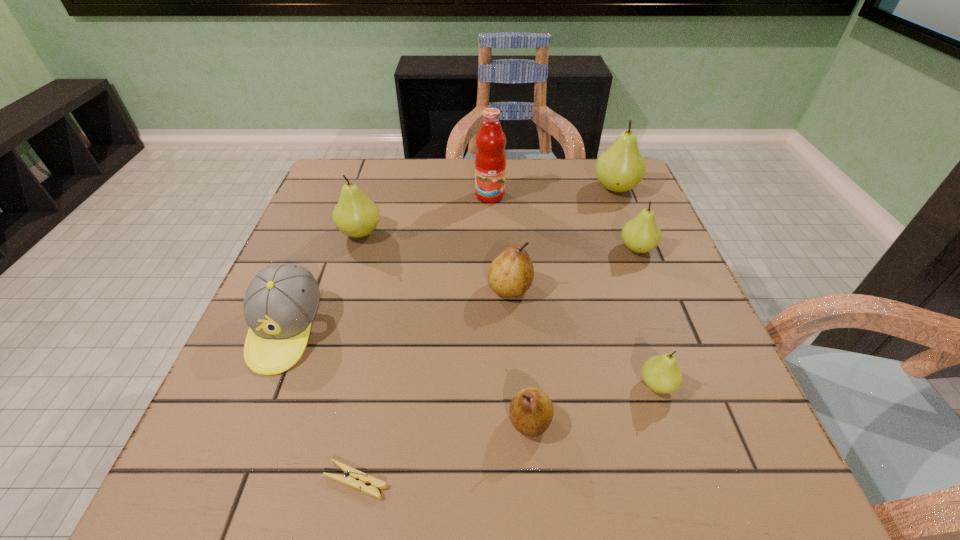
Where is `free space between the shortest object and the bigger brown pear`? The width and height of the screenshot is (960, 540). free space between the shortest object and the bigger brown pear is located at coordinates (433, 384).

Where is `free space between the third biggest green pear and the third nearest pear`? The height and width of the screenshot is (540, 960). free space between the third biggest green pear and the third nearest pear is located at coordinates (573, 268).

Identify the location of object that is the closest to the smaller brown pear. (661, 374).

This screenshot has width=960, height=540. I want to click on object that is the sixth closest to the smallest green pear, so click(x=490, y=159).

Identify which pear is located as the sixth nearest to the fruit juice. Please provide its 2D coordinates. Your answer should be formatted as a tuple, i.e. [(x, y)], where the tuple contains the x and y coordinates of a point satisfying the conditions above.

[(531, 411)]

Locate an element on the screen. the fourth closest pear to the biggest green pear is located at coordinates point(355,215).

Where is `green pear that stands as the fourth closest to the clothespin`? This screenshot has height=540, width=960. green pear that stands as the fourth closest to the clothespin is located at coordinates (620, 168).

You are a GUI agent. You are given a task and a screenshot of the screen. Output one action in this format:
    pyautogui.click(x=<x>, y=<y>)
    Task: Click on the second closest green pear to the fruit juice
    
    Given the screenshot: What is the action you would take?
    pyautogui.click(x=620, y=168)

You are a GUI agent. You are given a task and a screenshot of the screen. Output one action in this format:
    pyautogui.click(x=<x>, y=<y>)
    Task: Click on the free location that satisfies the following two spatial constraints: 1. on the back side of the nearer brown pear; 2. on the right side of the smallest green pear
    
    Given the screenshot: What is the action you would take?
    pos(527,385)

Image resolution: width=960 pixels, height=540 pixels. Identify the location of vacant area in the image that satisfies the following two spatial constraints: 1. on the front side of the fifth shortest pear; 2. on the right side of the nearest object. (283, 481).